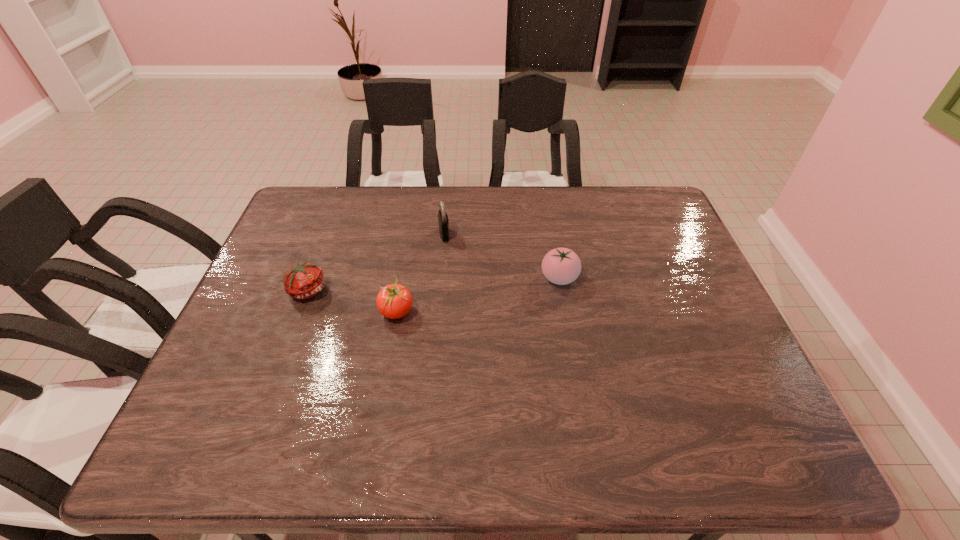
The image size is (960, 540). I want to click on the farthest object, so [443, 221].

In order to click on the second object from right to left in this screenshot , I will do `click(443, 221)`.

What are the coordinates of `the rightmost object` in the screenshot? It's located at (561, 266).

Identify the location of the second object from left to right. (394, 301).

Find the location of a particular element. The height and width of the screenshot is (540, 960). the leftmost tomato is located at coordinates (305, 280).

Locate an element on the screen. This screenshot has width=960, height=540. blank space located 0.060m on the back of the padlock is located at coordinates pyautogui.click(x=446, y=215).

Where is `vacant space situated on the back of the rightmost object`? The height and width of the screenshot is (540, 960). vacant space situated on the back of the rightmost object is located at coordinates (549, 221).

The image size is (960, 540). In order to click on vacant space located 0.130m on the left of the second object from left to right in this screenshot , I will do click(x=328, y=312).

What are the coordinates of `vacant region located 0.400m on the back of the leftmost tomato` in the screenshot? It's located at (345, 193).

Find the location of `object situated at the far edge`. object situated at the far edge is located at coordinates (443, 221).